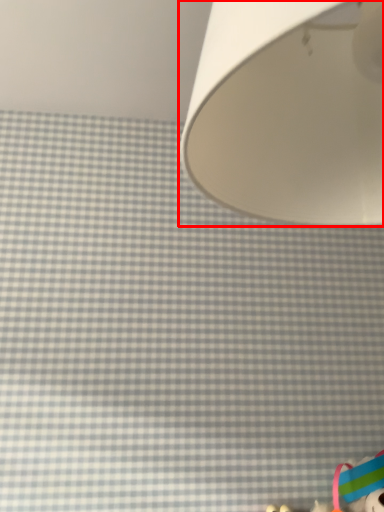
Question: Considering the relative positions of lamp (annotated by the red box) and toy in the image provided, where is lamp (annotated by the red box) located with respect to the staircase?

Choices:
 (A) right
 (B) left

Answer: (B)